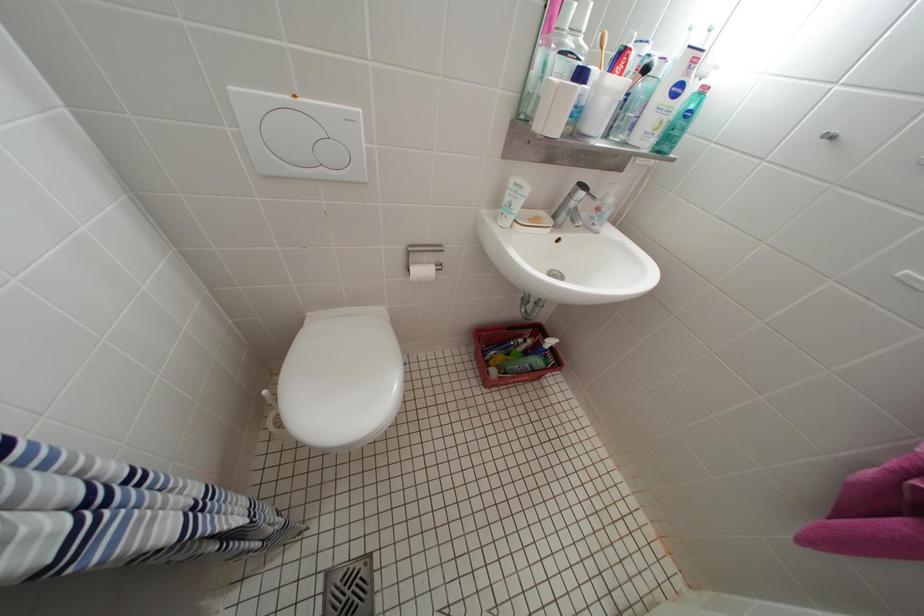
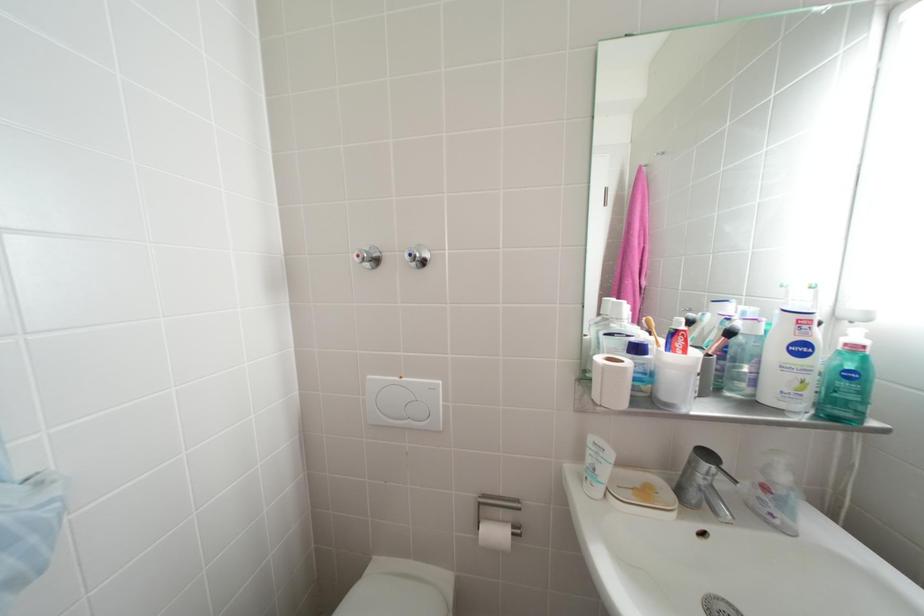
First-person continuous shooting, in which direction is the camera rotating?

The camera's rotation is toward left-up.